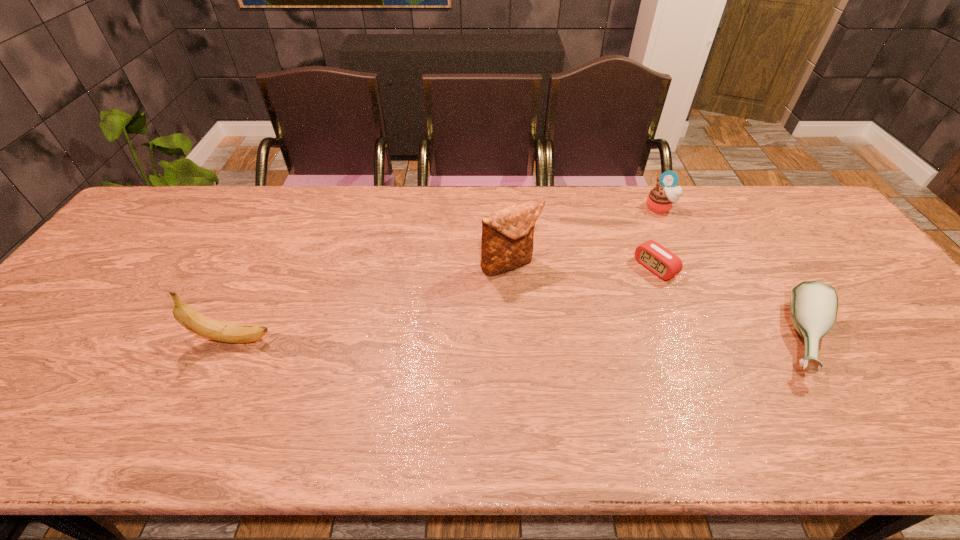
Where is `free space on the desktop that is between the leftmost object and the rightmost object and is positioned on the open side of the clutch bag`? The image size is (960, 540). free space on the desktop that is between the leftmost object and the rightmost object and is positioned on the open side of the clutch bag is located at coordinates (559, 339).

Image resolution: width=960 pixels, height=540 pixels. In order to click on vacant space on the desktop that is between the banana and the bottle and is positioned on the front-facing side of the shortest object in this screenshot , I will do `click(538, 339)`.

What are the coordinates of `free space on the desktop that is between the banana and the rightmost object and is positioned on the front-facing side of the third tallest object` in the screenshot? It's located at (564, 339).